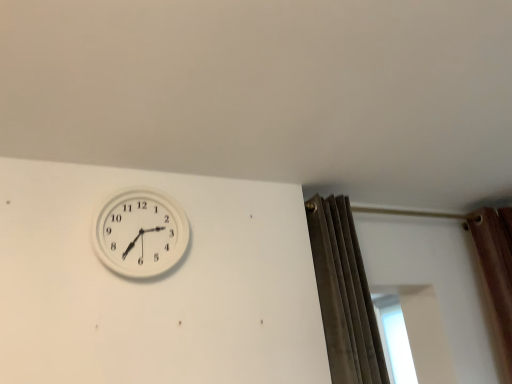
Describe the element at coordinates (344, 294) in the screenshot. I see `velvet gray curtain at right` at that location.

At what (x,y) coordinates should I click in order to perform the action: click on velvet gray curtain at right. Please return your answer as a coordinate pair (x, y). The image size is (512, 384). Looking at the image, I should click on (344, 294).

This screenshot has width=512, height=384. Describe the element at coordinates (140, 233) in the screenshot. I see `white plastic wall clock at upper left` at that location.

Measure the distance between white plastic wall clock at upper left and camera.

white plastic wall clock at upper left and camera are 1.47 meters apart.

Where is `white plastic wall clock at upper left`? This screenshot has width=512, height=384. white plastic wall clock at upper left is located at coordinates (140, 233).

Locate an element on the screen. Image resolution: width=512 pixels, height=384 pixels. velvet gray curtain at right is located at coordinates (344, 294).

Based on their positions, is velvet gray curtain at right located to the left or right of white plastic wall clock at upper left?

velvet gray curtain at right is to the right of white plastic wall clock at upper left.

In the image, is velvet gray curtain at right positioned in front of or behind white plastic wall clock at upper left?

Clearly, velvet gray curtain at right is behind white plastic wall clock at upper left.

Considering the positions of point (328, 345) and point (129, 193), is point (328, 345) closer or farther from the camera than point (129, 193)?

Point (328, 345) appears to be farther away from the viewer than point (129, 193).

From the image's perspective, is velvet gray curtain at right located above white plastic wall clock at upper left?

No.

From a real-world perspective, which object rests below the other?

velvet gray curtain at right, from a real-world perspective.

Looking at their sizes, would you say velvet gray curtain at right is wider or thinner than white plastic wall clock at upper left?

Considering their sizes, velvet gray curtain at right looks broader than white plastic wall clock at upper left.

Is velvet gray curtain at right shorter than white plastic wall clock at upper left?

No.

Considering the relative sizes of velvet gray curtain at right and white plastic wall clock at upper left in the image provided, is velvet gray curtain at right bigger than white plastic wall clock at upper left?

Yes.

Is velvet gray curtain at right not within white plastic wall clock at upper left?

Absolutely, velvet gray curtain at right is external to white plastic wall clock at upper left.

Is velvet gray curtain at right touching white plastic wall clock at upper left?

No, velvet gray curtain at right is not beside white plastic wall clock at upper left.

Is velvet gray curtain at right facing away from white plastic wall clock at upper left?

That's not correct — velvet gray curtain at right is not looking away from white plastic wall clock at upper left.

Where is `wall clock lying in front of the velvet gray curtain at right`? The width and height of the screenshot is (512, 384). wall clock lying in front of the velvet gray curtain at right is located at coordinates (140, 233).

Which is more to the right, white plastic wall clock at upper left or velvet gray curtain at right?

velvet gray curtain at right.

Is white plastic wall clock at upper left in front of velvet gray curtain at right?

Yes.

Which is closer, (174, 244) or (330, 285)?

Result: The point (174, 244) is more forward.

From the image's perspective, which one is positioned lower, white plastic wall clock at upper left or velvet gray curtain at right?

From the image's view, velvet gray curtain at right is below.

From a real-world perspective, is white plastic wall clock at upper left located beneath velvet gray curtain at right?

No, from a real-world perspective, white plastic wall clock at upper left is not beneath velvet gray curtain at right.

Consider the image. Is white plastic wall clock at upper left wider than velvet gray curtain at right?

No, white plastic wall clock at upper left is not wider than velvet gray curtain at right.

From their relative heights in the image, would you say white plastic wall clock at upper left is taller or shorter than velvet gray curtain at right?

In the image, white plastic wall clock at upper left appears to be shorter than velvet gray curtain at right.

Is white plastic wall clock at upper left bigger or smaller than velvet gray curtain at right?

Considering their sizes, white plastic wall clock at upper left takes up less space than velvet gray curtain at right.

Consider the image. Can we say white plastic wall clock at upper left lies outside velvet gray curtain at right?

Yes.

Would you say white plastic wall clock at upper left is a long distance from velvet gray curtain at right?

white plastic wall clock at upper left is actually quite close to velvet gray curtain at right.

Could you tell me if white plastic wall clock at upper left is turned towards velvet gray curtain at right?

No, white plastic wall clock at upper left does not turn towards velvet gray curtain at right.

Measure the distance from white plastic wall clock at upper left to velvet gray curtain at right.

white plastic wall clock at upper left is 72.75 centimeters from velvet gray curtain at right.

Where is `curtain that appears on the right of white plastic wall clock at upper left`? The height and width of the screenshot is (384, 512). curtain that appears on the right of white plastic wall clock at upper left is located at coordinates (344, 294).

Where is `wall clock on the left side of velvet gray curtain at right`? Image resolution: width=512 pixels, height=384 pixels. wall clock on the left side of velvet gray curtain at right is located at coordinates (140, 233).

Find the location of a particular element. Image resolution: width=512 pixels, height=384 pixels. wall clock that is above the velvet gray curtain at right (from the image's perspective) is located at coordinates (140, 233).